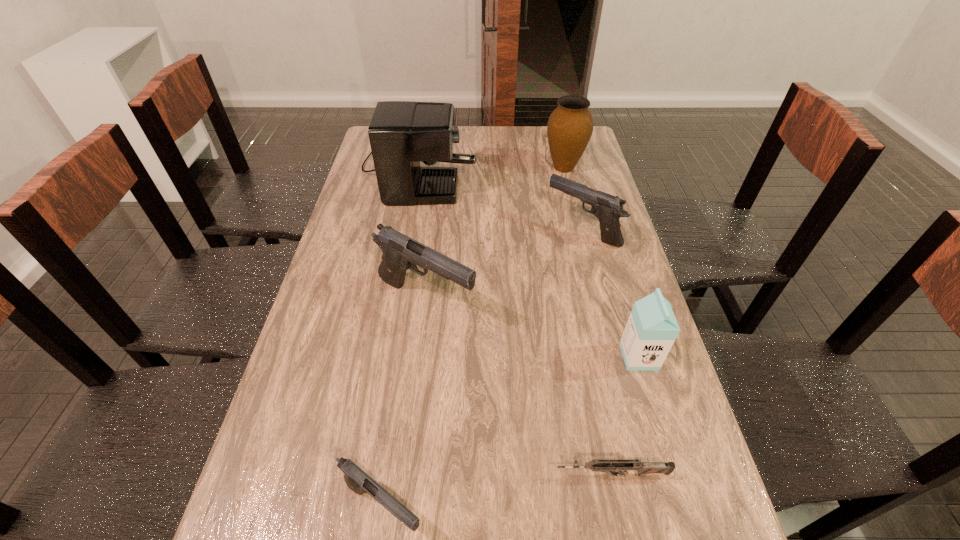
This screenshot has width=960, height=540. What are the coordinates of `blank space at the right edge of the desktop` in the screenshot? It's located at (622, 246).

You are a GUI agent. You are given a task and a screenshot of the screen. Output one action in this format:
    pyautogui.click(x=<x>, y=<y>)
    Task: Click on the vacant space that's between the shortest object and the milk carton
    The image size is (960, 540).
    Given the screenshot: What is the action you would take?
    tap(625, 416)

The width and height of the screenshot is (960, 540). I want to click on free spot between the brown urn and the second nearest black gun, so click(494, 234).

The image size is (960, 540). Find the location of `vacant space in between the grey gun and the white milk carton`. vacant space in between the grey gun and the white milk carton is located at coordinates (625, 416).

Locate an element on the screen. The width and height of the screenshot is (960, 540). empty location between the black coffee maker and the fourth nearest object is located at coordinates (422, 233).

Locate an element on the screen. This screenshot has width=960, height=540. free space between the biggest black gun and the white milk carton is located at coordinates (532, 329).

Find the location of a particular element. The image size is (960, 540). free space between the white milk carton and the farthest black gun is located at coordinates (611, 294).

In order to click on vacant space that's between the black coffee maker and the farthest black gun in this screenshot , I will do `click(501, 199)`.

Identify which object is the sixth nearest to the coffee maker. Please provide its 2D coordinates. Your answer should be formatted as a tuple, i.e. [(x, y)], where the tuple contains the x and y coordinates of a point satisfying the conditions above.

[(602, 465)]

Identify which object is the fourth nearest to the farthest black gun. Please provide its 2D coordinates. Your answer should be formatted as a tuple, i.e. [(x, y)], where the tuple contains the x and y coordinates of a point satisfying the conditions above.

[(651, 330)]